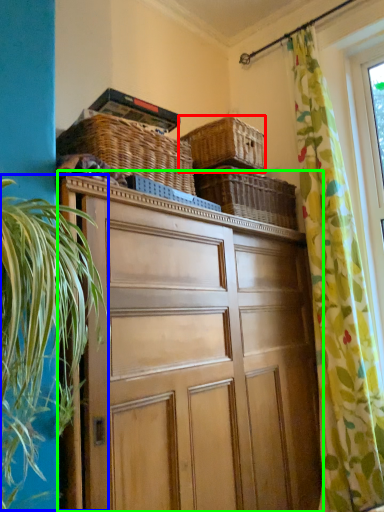
Question: Which object is the closest to the basket (highlighted by a red box)? Choose among these: vegetation (highlighted by a blue box) or cabinetry (highlighted by a green box).

Choices:
 (A) vegetation
 (B) cabinetry

Answer: (B)